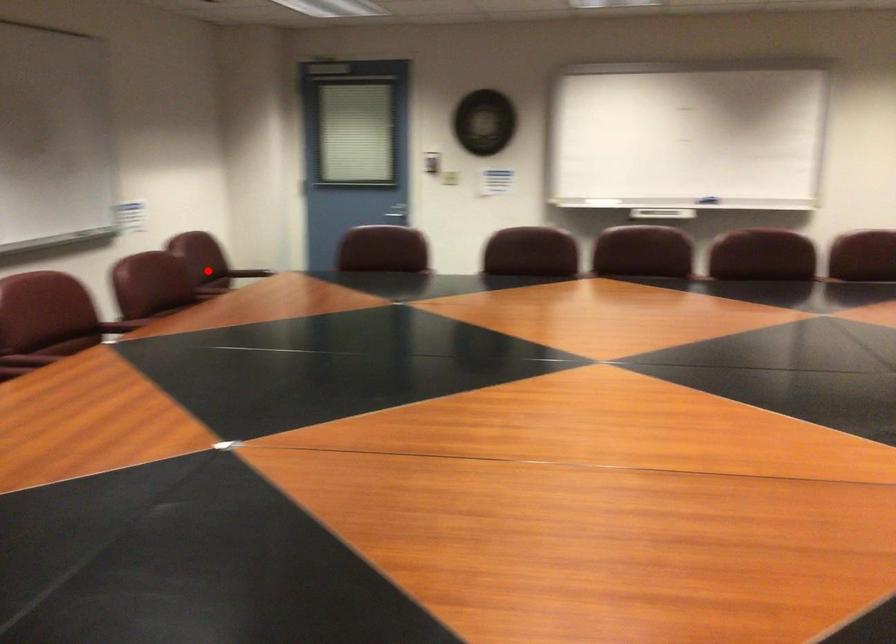
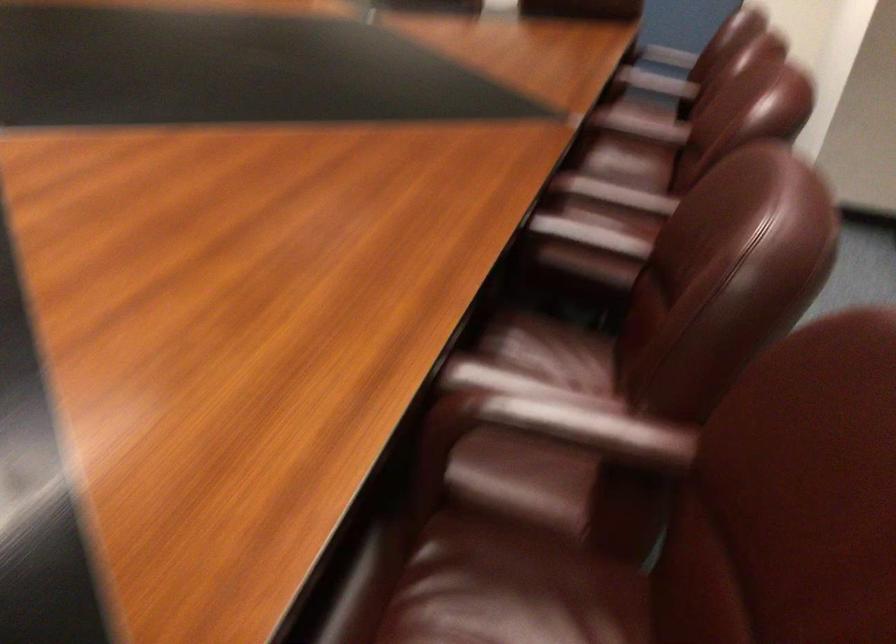
Find the pixel in the second image that matches the highlighted location in the first image.

(579, 428)